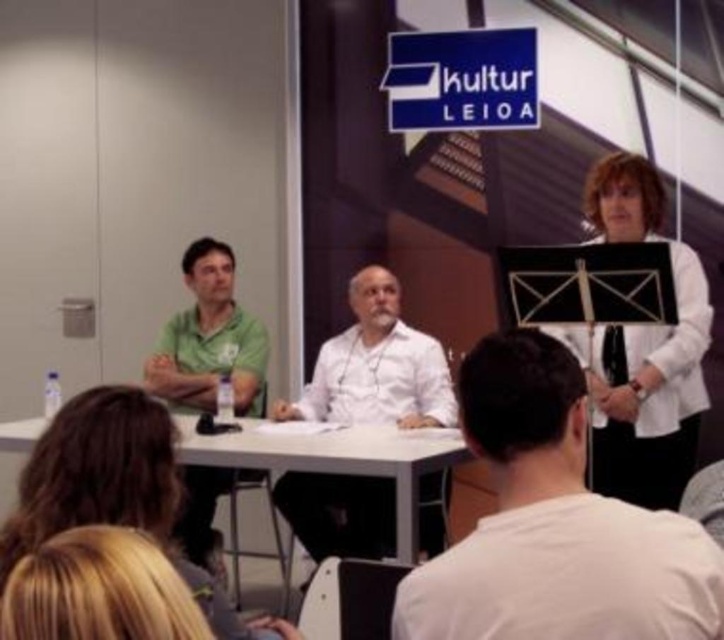
Does white cotton shirt at center have a lesser height compared to white plastic table at center?

Yes.

Which of these two, white cotton shirt at center or white plastic table at center, stands taller?

Standing taller between the two is white plastic table at center.

Between point (468, 605) and point (400, 444), which one is positioned in front?

Point (468, 605)

Identify the location of white cotton shirt at center. This screenshot has width=724, height=640. (555, 524).

What do you see at coordinates (376, 365) in the screenshot? I see `white matte shirt at center` at bounding box center [376, 365].

Can you confirm if white matte shirt at center is thinner than green matte shirt at left?

In fact, white matte shirt at center might be wider than green matte shirt at left.

Between point (418, 484) and point (161, 396), which one is positioned in front?

Point (418, 484) is in front.

I want to click on white matte shirt at center, so click(376, 365).

Who is more distant from viewer, (704, 580) or (248, 340)?

Positioned behind is point (248, 340).

Can you confirm if white cotton shirt at center is bigger than green matte shirt at left?

No, white cotton shirt at center is not bigger than green matte shirt at left.

At what (x,y) coordinates should I click in order to perform the action: click on white cotton shirt at center. Please return your answer as a coordinate pair (x, y). This screenshot has width=724, height=640. Looking at the image, I should click on (555, 524).